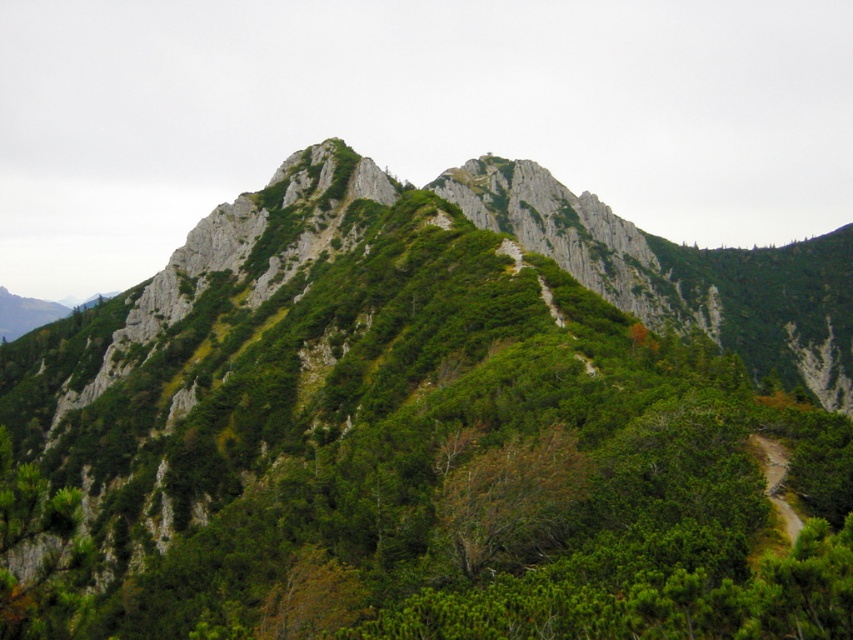
Question: Does brown leafy tree at center appear on the right side of brown dirt path at lower right?

Choices:
 (A) no
 (B) yes

Answer: (A)

Question: Which object appears closest to the camera in this image?

Choices:
 (A) brown leafy tree at center
 (B) brown dirt path at lower right

Answer: (B)

Question: In this image, where is brown leafy tree at center located relative to brown dirt path at lower right?

Choices:
 (A) above
 (B) below

Answer: (B)

Question: Is brown leafy tree at center positioned in front of brown dirt path at lower right?

Choices:
 (A) yes
 (B) no

Answer: (B)